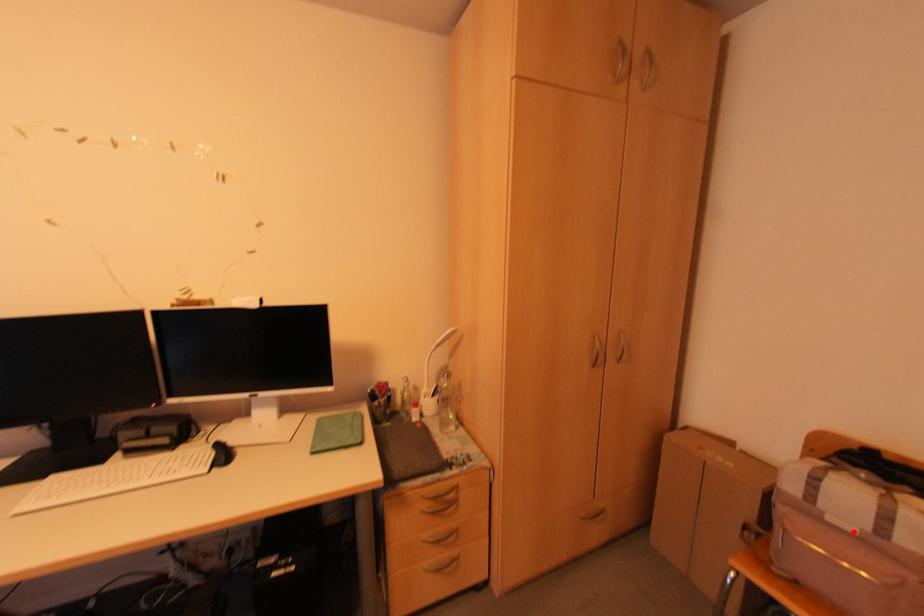
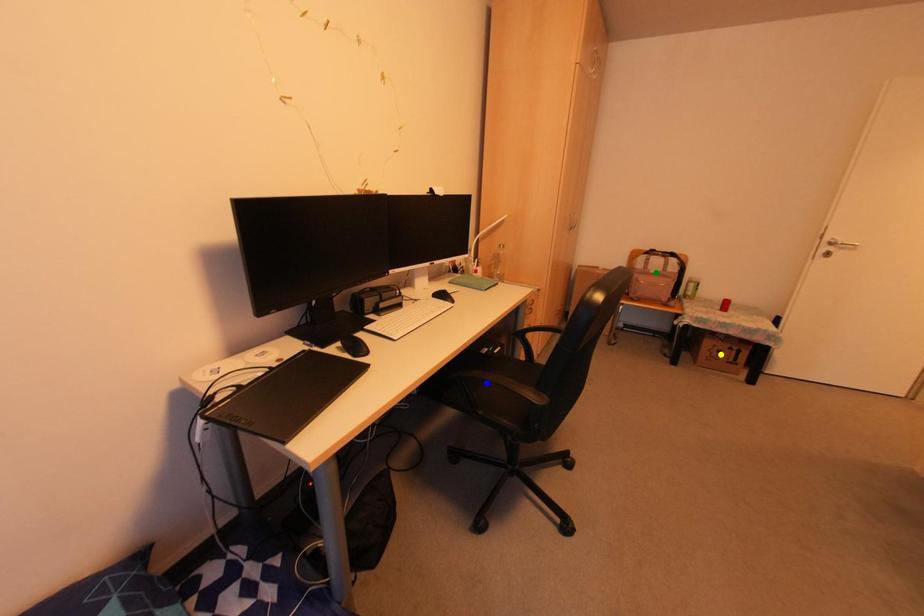
Question: I am providing you with two images of the same scene from different viewpoints. A red point is marked on the first image. You are given multiple points on the second image. Which mark in image 2 goes with the point in image 1?

Choices:
 (A) blue point
 (B) yellow point
 (C) green point

Answer: (C)